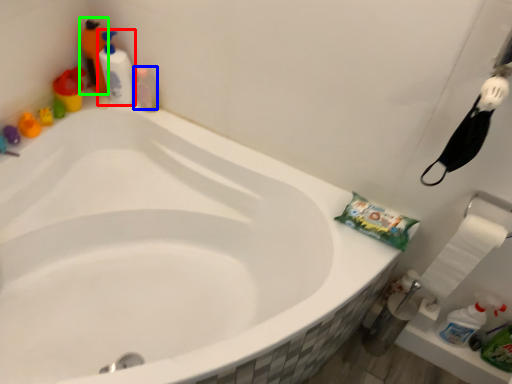
Question: Based on their relative distances, which object is farther from cleaning product (highlighted by a red box)? Choose from cleaning product (highlighted by a blue box) and cleaning product (highlighted by a green box).

Choices:
 (A) cleaning product
 (B) cleaning product

Answer: (B)